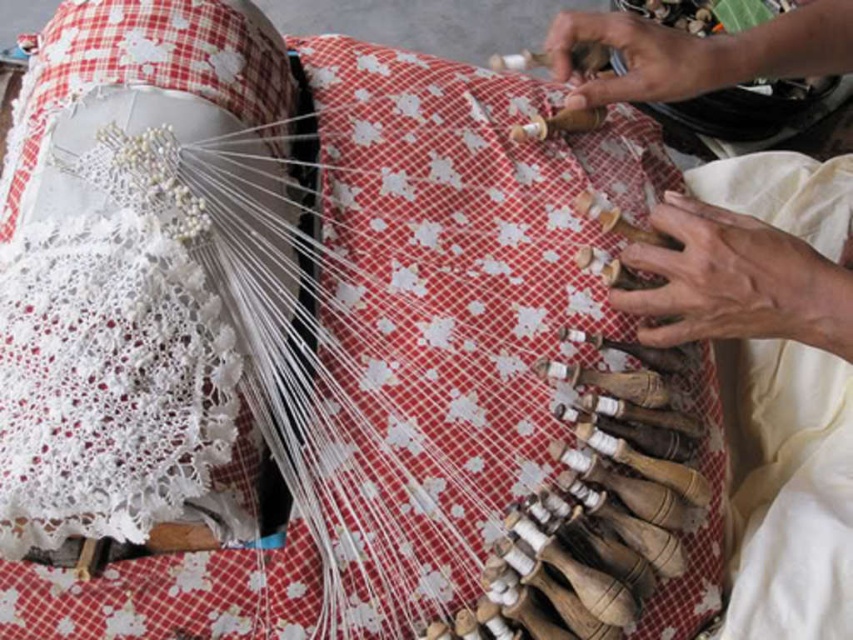
Looking at this image, you are an observer looking at the lace maker. Where is the dry skin at center in relation to the smooth skin hand at upper right?

The dry skin at center is located below the smooth skin hand at upper right.

You are a lace maker observing the two points in the lace piece. Which point is closer to you, point (666, 298) or point (602, 35)?

Point (666, 298) is closer to the viewer than point (602, 35).